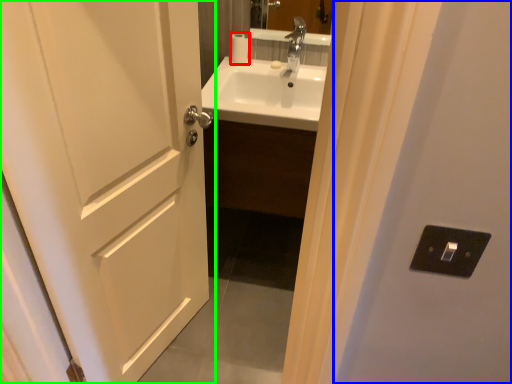
Question: Estimate the real-world distances between objects in this image. Which object is farther from toilet paper (highlighted by a red box), screen door (highlighted by a blue box) or door (highlighted by a green box)?

Choices:
 (A) screen door
 (B) door

Answer: (A)